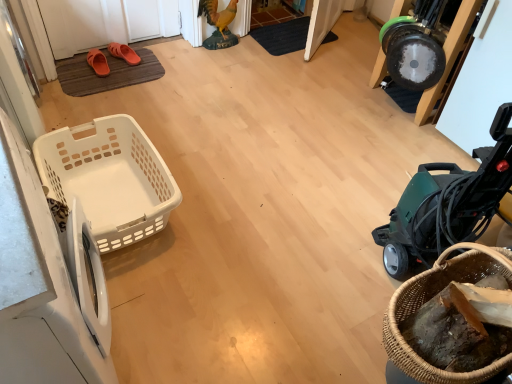
Locate an element on the screen. The image size is (512, 384). free space that is in between black textured doormat at center, arranged as the second doormat when viewed from the left, and brown rubber doormat at upper left, marked as the second doormat in a back-to-front arrangement is located at coordinates (202, 58).